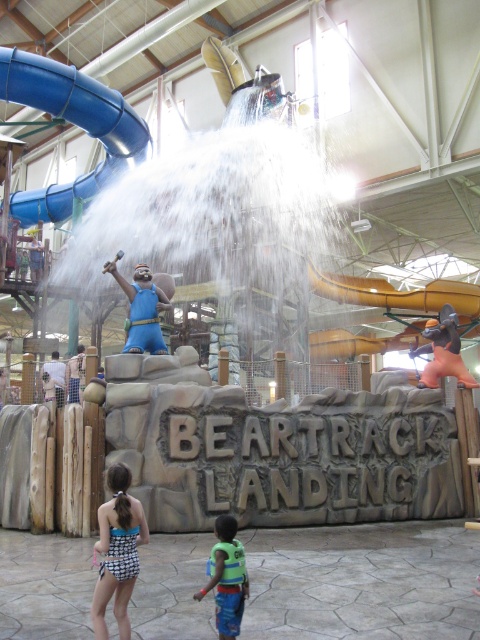
Is blue and white checkered swimsuit at lower left to the right of blue fabric shorts at center from the viewer's perspective?

Indeed, blue and white checkered swimsuit at lower left is positioned on the right side of blue fabric shorts at center.

Who is positioned more to the left, blue and white checkered swimsuit at lower left or blue fabric shorts at center?

From the viewer's perspective, blue fabric shorts at center appears more on the left side.

Which is in front, point (134, 513) or point (73, 396)?

Point (134, 513) is in front.

Locate an element on the screen. The image size is (480, 640). blue and white checkered swimsuit at lower left is located at coordinates (118, 552).

Between blue rubber slide at upper left and blue fabric shorts at center, which one has more height?

Standing taller between the two is blue rubber slide at upper left.

Consider the image. Which is more to the right, blue rubber slide at upper left or blue fabric shorts at center?

blue fabric shorts at center

This screenshot has height=640, width=480. Identify the location of blue rubber slide at upper left. (72, 124).

This screenshot has height=640, width=480. Find the location of `blue rubber slide at upper left`. blue rubber slide at upper left is located at coordinates (72, 124).

Between green life vest at lower center and blue fabric statue at center, which one appears on the left side from the viewer's perspective?

blue fabric statue at center is more to the left.

Measure the distance from green life vest at lower center to blue fabric statue at center.

A distance of 34.71 feet exists between green life vest at lower center and blue fabric statue at center.

Based on the photo, who is more distant from viewer, (237, 547) or (139, 273)?

Point (139, 273)

Locate an element on the screen. green life vest at lower center is located at coordinates (227, 577).